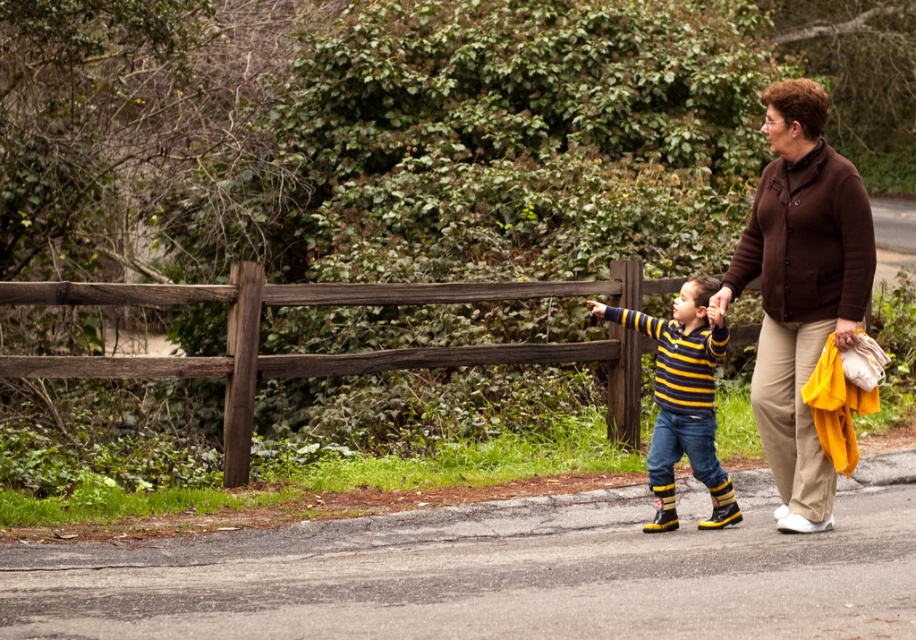
Question: Which point is closer to the camera?

Choices:
 (A) (235, 260)
 (B) (672, 467)

Answer: (B)

Question: Among these objects, which one is farthest from the camera?

Choices:
 (A) striped knit sweater at center
 (B) brown cardigan at right

Answer: (A)

Question: Can you confirm if brown cardigan at right is positioned below striped knit sweater at center?

Choices:
 (A) yes
 (B) no

Answer: (B)

Question: Which object is closer to the camera taking this photo?

Choices:
 (A) brown cardigan at right
 (B) brown wooden fence at left

Answer: (A)

Question: Where is brown wooden fence at left located in relation to striped knit sweater at center in the image?

Choices:
 (A) above
 (B) below

Answer: (A)

Question: In this image, where is brown cardigan at right located relative to striped knit sweater at center?

Choices:
 (A) left
 (B) right

Answer: (B)